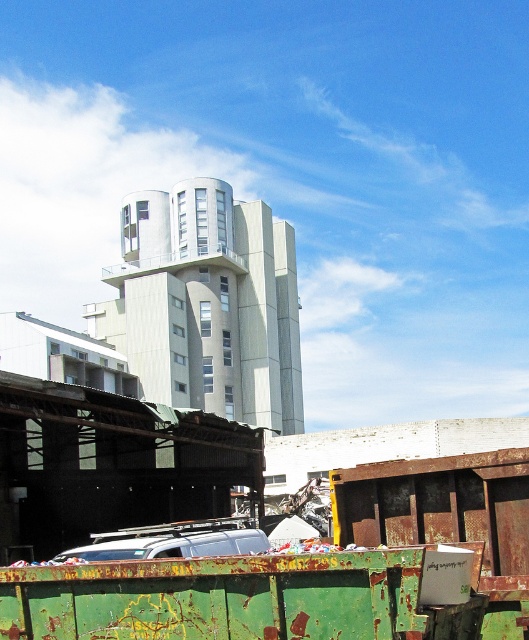
You are standing at the base of the large modern building and want to throw a small ball into the rusty green dumpster at lower left. If the maximum throwing distance you can achieve is 18 feet, will you be able to reach the dumpster?

The rusty green dumpster at lower left is 18.65 feet away from the viewer, which is beyond the maximum throwing distance of 18 feet. Therefore, you won not be able to reach the dumpster with your throw.

You are standing at the point marked by the coordinates point (234, 598) in the image of the urban scene. What object are you currently standing on?

The point (234, 598) indicates the rusty green dumpster at lower left, so you are standing on the rusty green dumpster at lower left.

You are a delivery driver who needs to park your vehicle in this area. You see the rusty green dumpster at lower left and the silver metallic van at lower center. Which vehicle takes up more space in the parking area?

The silver metallic van at lower center takes up more space in the parking area because the rusty green dumpster at lower left occupies less space than it.